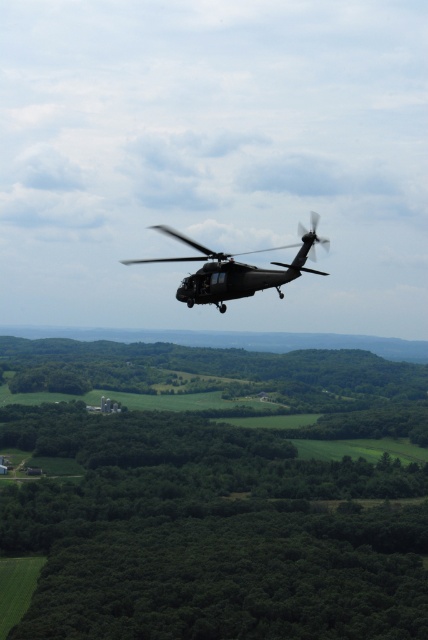
Can you confirm if green leafy trees at center is thinner than metallic gray helicopter at center?

Incorrect, green leafy trees at center's width is not less than metallic gray helicopter at center's.

Can you confirm if green leafy trees at center is bigger than metallic gray helicopter at center?

Yes, green leafy trees at center is bigger than metallic gray helicopter at center.

Is point (211, 595) positioned after point (300, 232)?

Yes.

Identify the location of green leafy trees at center. Image resolution: width=428 pixels, height=640 pixels. (216, 497).